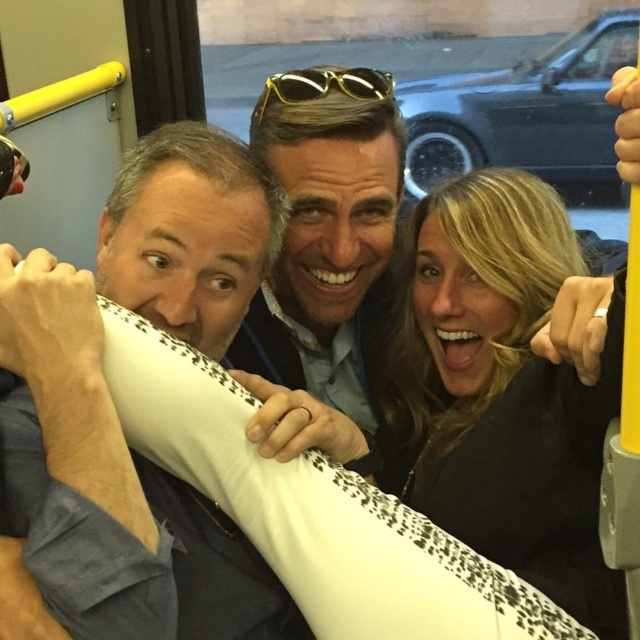
The image size is (640, 640). What are the coordinates of `matte blue shirt at left` in the screenshot? It's located at (116, 419).

Who is more distant from viewer, (228,182) or (576,528)?

The point (228,182) is more distant.

This screenshot has width=640, height=640. What do you see at coordinates (116, 419) in the screenshot?
I see `matte blue shirt at left` at bounding box center [116, 419].

Identify the location of matte blue shirt at left. This screenshot has width=640, height=640. 116,419.

Looking at this image, is black matte surfboard at center above gold metallic sunglasses at center?

Actually, black matte surfboard at center is below gold metallic sunglasses at center.

Is black matte surfboard at center to the left of gold metallic sunglasses at center from the viewer's perspective?

Incorrect, black matte surfboard at center is not on the left side of gold metallic sunglasses at center.

Find the location of a particular element. The height and width of the screenshot is (640, 640). black matte surfboard at center is located at coordinates (497, 392).

Does point (106, 273) lie behind point (260, 112)?

No, it is not.

Can you confirm if matte blue shirt at left is positioned below gold metallic sunglasses at center?

Indeed, matte blue shirt at left is positioned under gold metallic sunglasses at center.

Measure the distance between point (x=51, y=550) and camera.

Point (x=51, y=550) and camera are 73.20 centimeters apart from each other.

Identify the location of matte blue shirt at left. click(x=116, y=419).